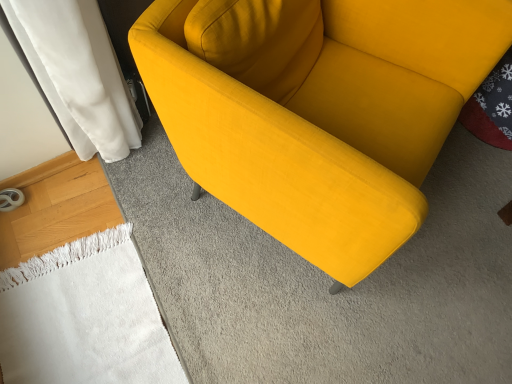
What is the approximate height of white soft towel at lower left?

white soft towel at lower left is 0.84 inches in height.

The width and height of the screenshot is (512, 384). What do you see at coordinates (85, 317) in the screenshot? I see `white soft towel at lower left` at bounding box center [85, 317].

At what (x,y) coordinates should I click in order to perform the action: click on white soft towel at lower left. Please return your answer as a coordinate pair (x, y). Looking at the image, I should click on (85, 317).

What is the approximate width of white soft towel at lower left?

white soft towel at lower left is 18.01 inches wide.

Image resolution: width=512 pixels, height=384 pixels. Identify the location of velvet yellow couch at center. (318, 109).

The image size is (512, 384). Describe the element at coordinates (318, 109) in the screenshot. I see `velvet yellow couch at center` at that location.

The image size is (512, 384). Find the location of `white soft towel at lower left`. white soft towel at lower left is located at coordinates (85, 317).

Which object is positioned more to the left, velvet yellow couch at center or white soft towel at lower left?

white soft towel at lower left.

Between velvet yellow couch at center and white soft towel at lower left, which one is positioned in front?

velvet yellow couch at center is closer to the camera.

Which is in front, point (411, 235) or point (72, 342)?

The point (411, 235) is more forward.

From the image's perspective, is velvet yellow couch at center above or below white soft towel at lower left?

Clearly, from the image's perspective, velvet yellow couch at center is above white soft towel at lower left.

From a real-world perspective, is velvet yellow couch at center above or below white soft towel at lower left?

velvet yellow couch at center is situated higher than white soft towel at lower left in the real world.

Is velvet yellow couch at center wider than white soft towel at lower left?

Yes.

Considering the sizes of velvet yellow couch at center and white soft towel at lower left in the image, is velvet yellow couch at center taller or shorter than white soft towel at lower left?

Clearly, velvet yellow couch at center is taller compared to white soft towel at lower left.

Is velvet yellow couch at center bigger than white soft towel at lower left?

Yes, velvet yellow couch at center is bigger than white soft towel at lower left.

Would you say white soft towel at lower left is part of velvet yellow couch at center's contents?

No, white soft towel at lower left is not a part of velvet yellow couch at center.

Is there a large distance between velvet yellow couch at center and white soft towel at lower left?

No, velvet yellow couch at center is not far from white soft towel at lower left.

Is velvet yellow couch at center aimed at white soft towel at lower left?

No, velvet yellow couch at center is not facing towards white soft towel at lower left.

Measure the distance from velvet yellow couch at center to white soft towel at lower left.

velvet yellow couch at center is 28.08 inches away from white soft towel at lower left.

This screenshot has height=384, width=512. I want to click on studio couch in front of the white soft towel at lower left, so click(318, 109).

Between white soft towel at lower left and velvet yellow couch at center, which one appears on the left side from the viewer's perspective?

white soft towel at lower left is more to the left.

Which object is further away from the camera, white soft towel at lower left or velvet yellow couch at center?

white soft towel at lower left is more distant.

Does point (10, 377) lie in front of point (387, 57)?

Yes, point (10, 377) is closer to viewer.

From the image's perspective, which is below, white soft towel at lower left or velvet yellow couch at center?

white soft towel at lower left.

From a real-world perspective, which object rests below the other?

white soft towel at lower left is physically lower.

Between white soft towel at lower left and velvet yellow couch at center, which one has smaller width?

With smaller width is white soft towel at lower left.

Considering the sizes of objects white soft towel at lower left and velvet yellow couch at center in the image provided, who is shorter, white soft towel at lower left or velvet yellow couch at center?

With less height is white soft towel at lower left.

Can you confirm if white soft towel at lower left is smaller than velvet yellow couch at center?

Indeed, white soft towel at lower left has a smaller size compared to velvet yellow couch at center.

Which is correct: white soft towel at lower left is inside velvet yellow couch at center, or outside of it?

white soft towel at lower left is not inside velvet yellow couch at center, it's outside.

Is white soft towel at lower left not close to velvet yellow couch at center?

No.

Looking at this image, is velvet yellow couch at center at the back of white soft towel at lower left?

white soft towel at lower left is not turned away from velvet yellow couch at center.

In order to click on studio couch that is above the white soft towel at lower left (from a real-world perspective) in this screenshot , I will do `click(318, 109)`.

In order to click on blanket below the velvet yellow couch at center (from a real-world perspective) in this screenshot , I will do `click(85, 317)`.

Identify the location of blanket behind the velvet yellow couch at center. The image size is (512, 384). click(85, 317).